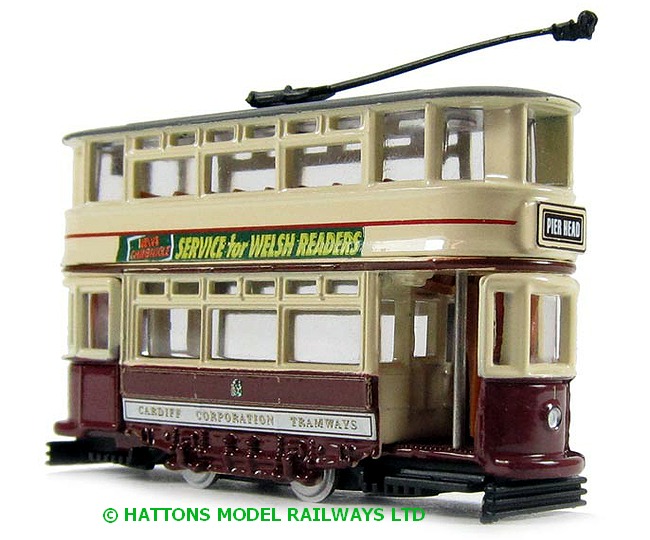
Locate an element on the screen. The image size is (650, 540). door is located at coordinates (402, 403).